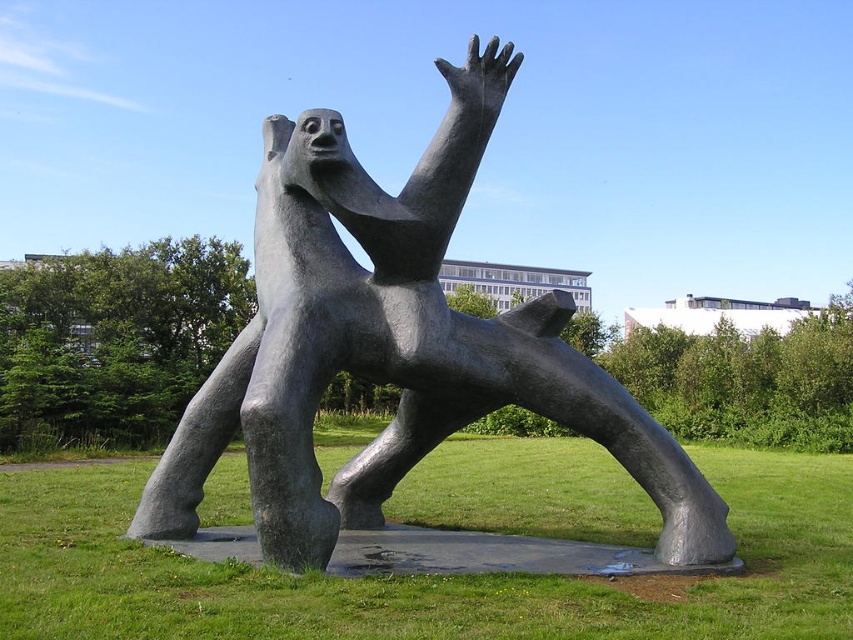
Between polished bronze sculpture at center and green grass at center, which one appears on the left side from the viewer's perspective?

From the viewer's perspective, polished bronze sculpture at center appears more on the left side.

Image resolution: width=853 pixels, height=640 pixels. Find the location of `polished bronze sculpture at center`. polished bronze sculpture at center is located at coordinates (393, 348).

Who is more forward, (x=260, y=532) or (x=767, y=566)?

Point (x=260, y=532) is more forward.

Find the location of a particular element. polished bronze sculpture at center is located at coordinates (393, 348).